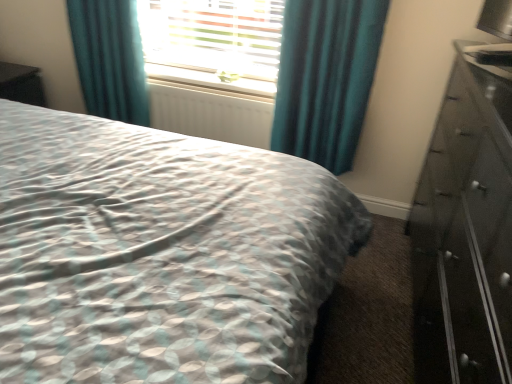
Question: Can you confirm if black glossy chest of drawers at right is shorter than teal velvet curtain at upper left, the second curtain from the right?

Choices:
 (A) yes
 (B) no

Answer: (B)

Question: Can you confirm if black glossy chest of drawers at right is thinner than teal velvet curtain at upper left, the second curtain from the right?

Choices:
 (A) yes
 (B) no

Answer: (B)

Question: Would you say black glossy chest of drawers at right is outside teal velvet curtain at upper left, the second curtain from the right?

Choices:
 (A) no
 (B) yes

Answer: (B)

Question: Is black glossy chest of drawers at right positioned before teal velvet curtain at upper left, the 1th curtain in the left-to-right sequence?

Choices:
 (A) no
 (B) yes

Answer: (B)

Question: Is black glossy chest of drawers at right directly adjacent to teal velvet curtain at upper left, the second curtain from the right?

Choices:
 (A) yes
 (B) no

Answer: (B)

Question: Is point (106, 18) positioned closer to the camera than point (313, 3)?

Choices:
 (A) closer
 (B) farther

Answer: (B)

Question: In the image, is teal velvet curtain at upper left, the second curtain from the right, positioned in front of or behind teal fabric curtain at upper center, the first curtain from the right?

Choices:
 (A) behind
 (B) front

Answer: (A)

Question: In terms of size, does teal velvet curtain at upper left, the second curtain from the right, appear bigger or smaller than teal fabric curtain at upper center, the first curtain from the right?

Choices:
 (A) small
 (B) big

Answer: (A)

Question: Is teal velvet curtain at upper left, the second curtain from the right, wider or thinner than teal fabric curtain at upper center, the 2th curtain in the left-to-right sequence?

Choices:
 (A) thin
 (B) wide

Answer: (A)

Question: From the image's perspective, is teal fabric curtain at upper center, the first curtain from the right, positioned above or below white textured radiator at center?

Choices:
 (A) above
 (B) below

Answer: (A)

Question: In terms of size, does teal fabric curtain at upper center, the first curtain from the right, appear bigger or smaller than white textured radiator at center?

Choices:
 (A) big
 (B) small

Answer: (A)

Question: Considering the relative positions of teal fabric curtain at upper center, the first curtain from the right, and white textured radiator at center in the image provided, is teal fabric curtain at upper center, the first curtain from the right, to the left or to the right of white textured radiator at center?

Choices:
 (A) left
 (B) right

Answer: (B)

Question: Relative to white textured radiator at center, is teal fabric curtain at upper center, the first curtain from the right, in front or behind?

Choices:
 (A) behind
 (B) front

Answer: (B)

Question: Is black glossy vanity at left in front of or behind teal velvet curtain at upper left, the second curtain from the right, in the image?

Choices:
 (A) behind
 (B) front

Answer: (A)

Question: In terms of height, does black glossy vanity at left look taller or shorter compared to teal velvet curtain at upper left, the 1th curtain in the left-to-right sequence?

Choices:
 (A) short
 (B) tall

Answer: (A)